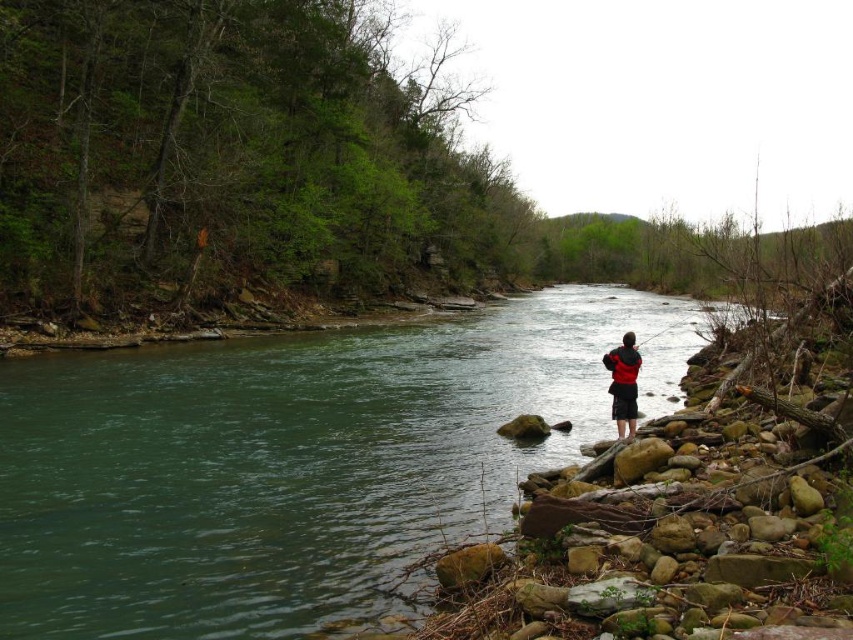
You are a hiker who has just arrived at the riverside. You see the green smooth water at center and the red fabric jacket at center. Which object is located to the right of the other?

The red fabric jacket at center is located to the right of the green smooth water at center.

You are a hiker who wants to cross the river using the green smooth water at center and the red fabric jacket at center as landmarks. Since you need to know which one is taller to plan your path, can you tell me which object is higher in this scene?

The green smooth water at center has a greater height compared to the red fabric jacket at center, so the green smooth water at center is taller.

You are standing at point (618,356) and want to reach the riverbank. There is a point at (158,547) which is in front of you. Can you walk directly to that point without obstacles?

Yes, you can walk directly to point (158,547) because it is in front of point (618,356) and there are no obstacles mentioned between them in the scene description.